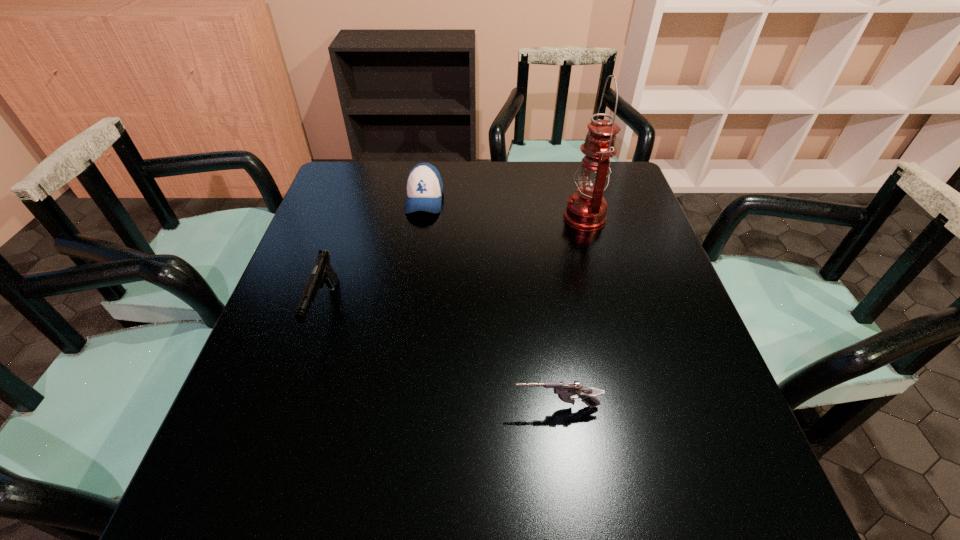
Image resolution: width=960 pixels, height=540 pixels. Identify the location of vacant position located 0.330m on the front-facing side of the third tallest object. (408, 308).

Image resolution: width=960 pixels, height=540 pixels. Find the location of `vacant region located at the barrel of the shorter gun`. vacant region located at the barrel of the shorter gun is located at coordinates (371, 407).

Locate an element on the screen. This screenshot has height=540, width=960. free space located at the barrel of the shorter gun is located at coordinates (349, 407).

In order to click on free space located 0.080m at the barrel of the shorter gun in this screenshot , I will do `click(471, 407)`.

Where is `oil lamp situated at the far edge`? oil lamp situated at the far edge is located at coordinates (586, 209).

Where is `baseball cap at the far edge`? This screenshot has height=540, width=960. baseball cap at the far edge is located at coordinates (424, 187).

In order to click on object that is at the left edge in this screenshot , I will do `click(323, 272)`.

The height and width of the screenshot is (540, 960). I want to click on object that is at the right edge, so click(x=586, y=209).

The image size is (960, 540). Find the location of `object situated at the far right corner`. object situated at the far right corner is located at coordinates (586, 209).

I want to click on free region at the far edge of the desktop, so click(516, 189).